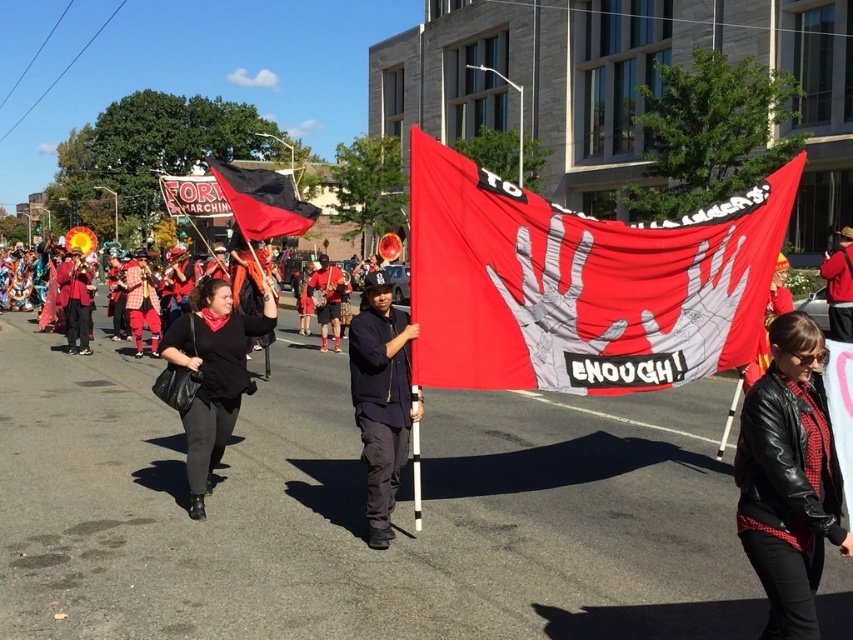
Question: Is red fabric banner at center to the left of black leather jacket at center from the viewer's perspective?

Choices:
 (A) yes
 (B) no

Answer: (B)

Question: Which point is farther to the camera?

Choices:
 (A) (233, 385)
 (B) (405, 333)
 (C) (231, 164)

Answer: (C)

Question: Is dark blue fabric jacket at center above red fabric pants at center?

Choices:
 (A) yes
 (B) no

Answer: (B)

Question: Is black matte shirt at center further to the viewer compared to black fabric flag at center?

Choices:
 (A) yes
 (B) no

Answer: (B)

Question: Which point appears farthest from the camera in this image?

Choices:
 (A) (283, 214)
 (B) (370, 528)
 (C) (225, 356)

Answer: (A)

Question: Among these objects, which one is farthest from the camera?

Choices:
 (A) red fabric pants at center
 (B) black leather jacket at center
 (C) red fabric banner at center

Answer: (A)